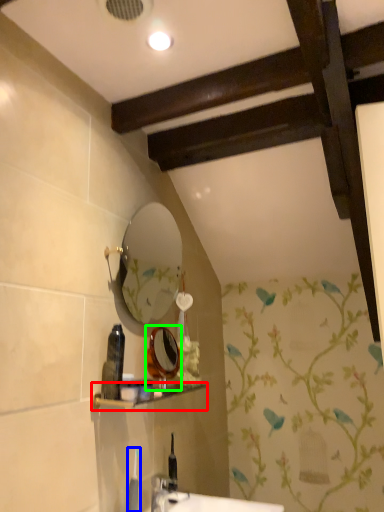
Question: Which object is the closest to the shelf (highlighted by a red box)? Choose among these: toiletry (highlighted by a blue box) or mirror (highlighted by a green box).

Choices:
 (A) toiletry
 (B) mirror

Answer: (B)